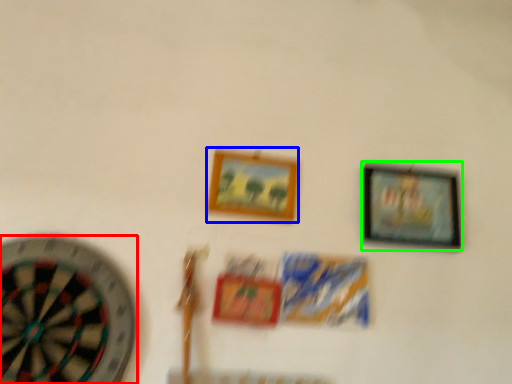
Question: Based on their relative distances, which object is farther from wheel (highlighted by a red box)? Choose from picture frame (highlighted by a blue box) and picture frame (highlighted by a green box).

Choices:
 (A) picture frame
 (B) picture frame

Answer: (B)